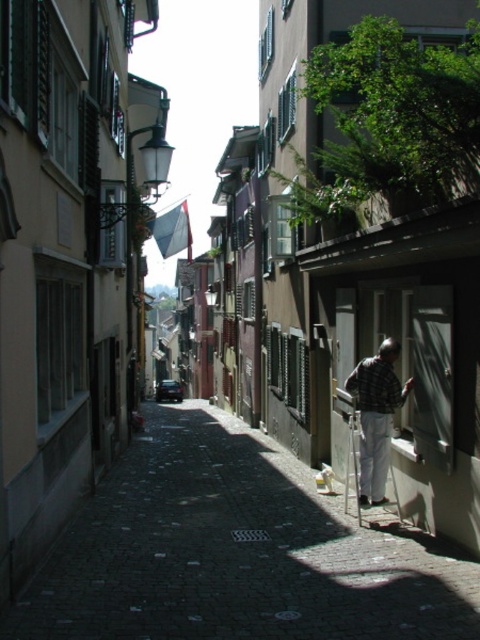
Who is shorter, checkered fabric shirt at right or metallic silver ladder at lower right?

With less height is metallic silver ladder at lower right.

Which is in front, point (393, 340) or point (396, 502)?

Point (393, 340) is more forward.

The height and width of the screenshot is (640, 480). Find the location of `checkered fabric shirt at right`. checkered fabric shirt at right is located at coordinates (375, 417).

The image size is (480, 640). In order to click on checkered fabric shirt at right in this screenshot , I will do pyautogui.click(x=375, y=417).

Does point (112, 627) come behind point (392, 426)?

No, (112, 627) is closer to viewer.

Is point (228, 561) closer to camera compared to point (370, 369)?

Yes, point (228, 561) is closer to viewer.

Where is `smooth cobblestone street at center`? The image size is (480, 640). smooth cobblestone street at center is located at coordinates (236, 552).

Is the position of smooth cobblestone street at center more distant than that of metallic silver ladder at lower right?

That is False.

In the scene shown: Is smooth cobblestone street at center taller than metallic silver ladder at lower right?

In fact, smooth cobblestone street at center may be shorter than metallic silver ladder at lower right.

This screenshot has width=480, height=640. Find the location of `smooth cobblestone street at center`. smooth cobblestone street at center is located at coordinates (236, 552).